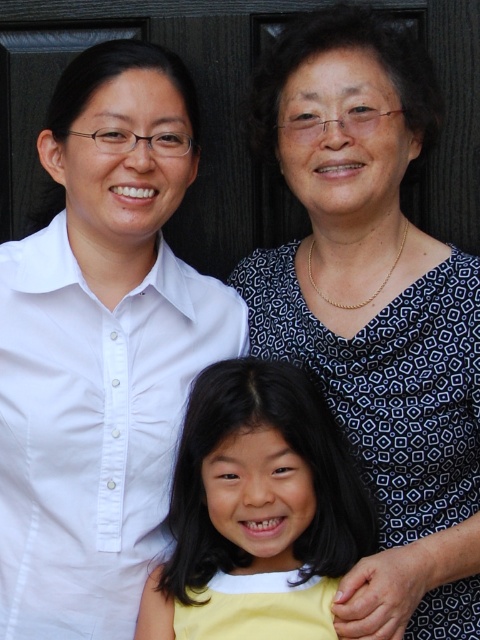
Which is in front, point (350, 440) or point (236, 362)?

Positioned in front is point (236, 362).

Is point (476, 381) farther from viewer compared to point (340, 531)?

Yes, point (476, 381) is behind point (340, 531).

This screenshot has height=640, width=480. Find the location of `patterned fabric blouse at center`. patterned fabric blouse at center is located at coordinates click(374, 310).

Which is in front, point (8, 353) or point (218, 406)?

Point (218, 406) is more forward.

Is point (93, 228) positioned before point (192, 470)?

No, (93, 228) is behind (192, 470).

Is point (152, 531) positioned after point (167, 573)?

Yes, point (152, 531) is farther from viewer.

Identify the location of matte black blouse at upper right. This screenshot has height=640, width=480. (100, 348).

Is matte black blouse at upper right smaller than patterned fabric blouse at center?

Yes, matte black blouse at upper right is smaller than patterned fabric blouse at center.

Is point (68, 321) more distant than point (467, 532)?

Yes, point (68, 321) is behind point (467, 532).

Image resolution: width=480 pixels, height=640 pixels. Identify the location of matte black blouse at upper right. (100, 348).